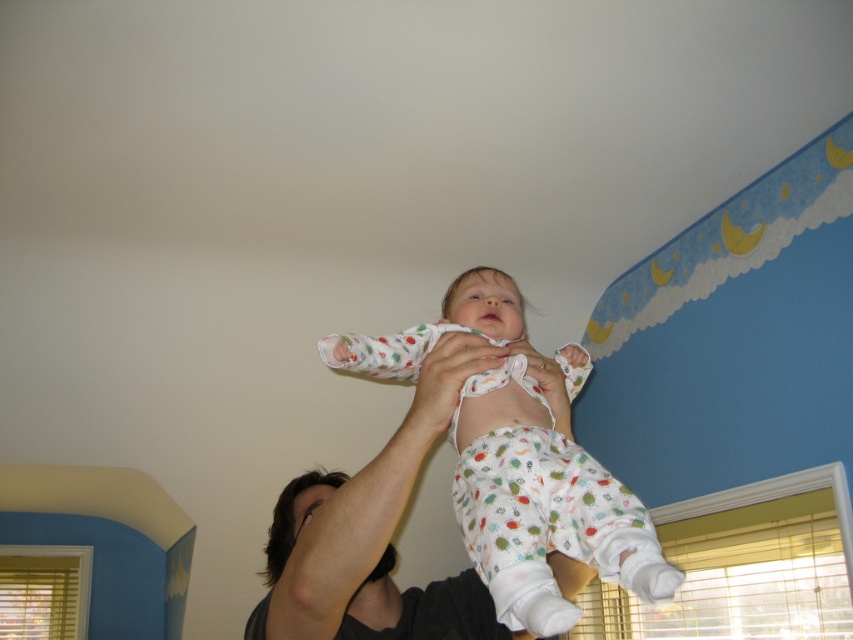
You are a photographer capturing this joyful moment. You want to ensure the white cotton onesie at center and the smooth skin arm at upper center are both clearly visible in the photo. Which object should you focus on first to ensure both are in frame?

The smooth skin arm at upper center should be focused on first because the white cotton onesie at center is positioned to its right side, so adjusting the frame to include the arm ensures the onesie will also be captured.

You are designing a safety harness for a baby in the image. The harness needs to securely hold the white cotton onesie at center and the smooth skin arm at upper center. Given their size difference, which part of the harness should be larger?

The harness part for the white cotton onesie at center should be larger because it is larger in size than the smooth skin arm at upper center.

You are standing in the room and want to place a small decorative star exactly at the point marked as point (546, 564). If your hand is currently 100 centimeters away from that point, how much closer do you need to move your hand to reach the exact location?

The distance of point (546, 564) from the viewer is 96.24 centimeters. Since your hand is currently 100 centimeters away, you need to move it 3.76 centimeters closer to reach the exact location.